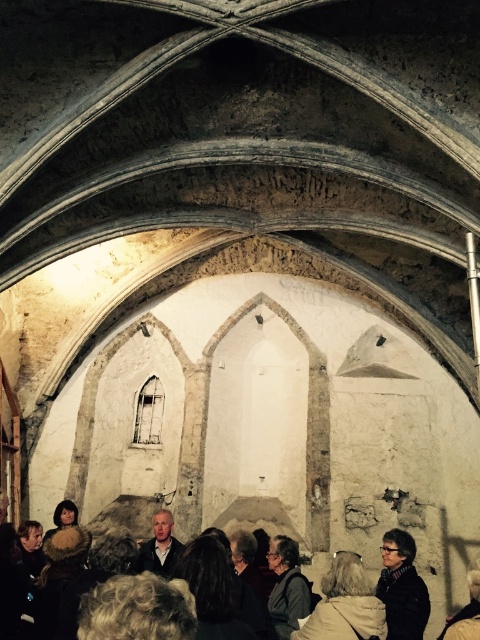
You are standing in the historic stone building and see a point marked at coordinates [402,588]. According to the image, what object is this point located on?

The point at coordinates [402,588] is located on the matte black jacket at lower right.

You are a visitor in this historic building and see both the dark brown leather jacket at lower center and the matte black jacket at lower right. Which jacket is closer to the left side of the room?

The dark brown leather jacket at lower center is positioned on the left side of the matte black jacket at lower right, so it is closer to the left side of the room.

You are a security guard in this historic building and need to place a new security camera. The camera must be positioned so it can monitor both the matte black jacket at lower right and the dark gray fabric jacket at center. Considering their heights, which jacket will the camera need to be angled higher to view properly?

The camera will need to be angled higher to view the matte black jacket at lower right properly since it is much taller than the dark gray fabric jacket at center.